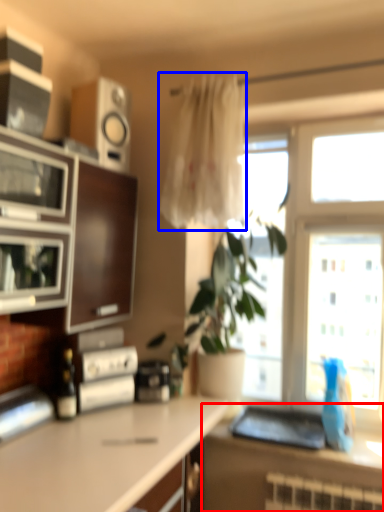
Question: Among these objects, which one is nearest to the camera, countertop (highlighted by a red box) or curtain (highlighted by a blue box)?

Choices:
 (A) countertop
 (B) curtain

Answer: (A)